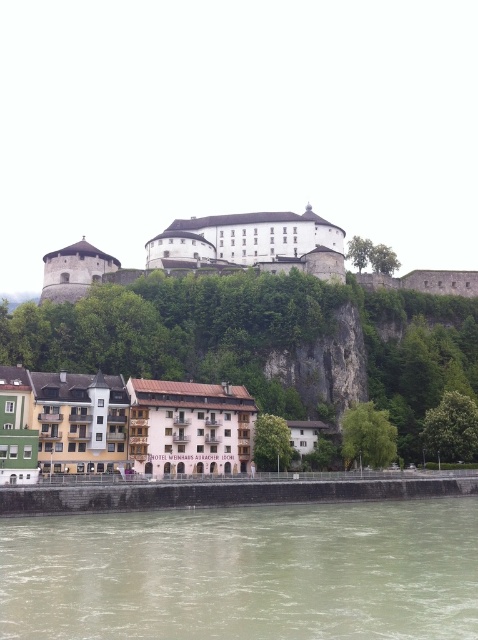
Question: Which of the following is the closest to the observer?

Choices:
 (A) brown sedimentary rock at lower center
 (B) multicolored painted buildings at lower center

Answer: (A)

Question: Which object is closer to the camera taking this photo?

Choices:
 (A) multicolored painted buildings at lower center
 (B) brown sedimentary rock at lower center

Answer: (B)

Question: Which of the following is the closest to the observer?

Choices:
 (A) brown sedimentary rock at lower center
 (B) multicolored painted buildings at lower center

Answer: (A)

Question: Is brown sedimentary rock at lower center wider than multicolored painted buildings at lower center?

Choices:
 (A) no
 (B) yes

Answer: (B)

Question: Does brown sedimentary rock at lower center appear on the left side of multicolored painted buildings at lower center?

Choices:
 (A) no
 (B) yes

Answer: (A)

Question: Can you confirm if brown sedimentary rock at lower center is positioned above multicolored painted buildings at lower center?

Choices:
 (A) no
 (B) yes

Answer: (A)